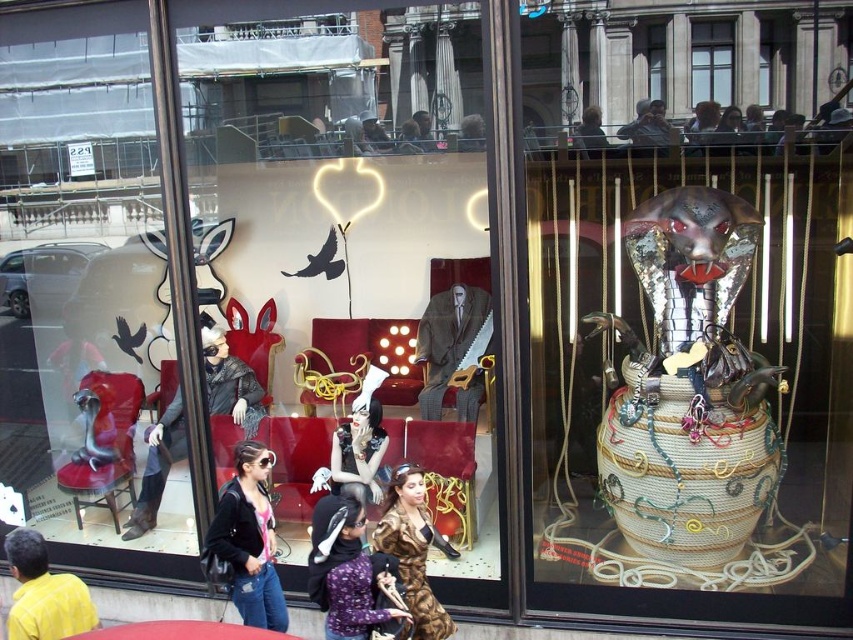
Question: Can you confirm if denim jacket at lower left is smaller than printed silk blouse at center?

Choices:
 (A) yes
 (B) no

Answer: (B)

Question: Based on their relative distances, which object is nearer to the denim jacket at lower left?

Choices:
 (A) printed silk blouse at center
 (B) clear glass window at upper center

Answer: (A)

Question: Which object is the farthest from the printed silk blouse at center?

Choices:
 (A) clear glass window at upper center
 (B) yellow shirt at lower left

Answer: (A)

Question: Can you confirm if printed silk blouse at center is bigger than leopard print dress at center?

Choices:
 (A) yes
 (B) no

Answer: (B)

Question: Which of the following is the closest to the observer?

Choices:
 (A) denim jacket at lower left
 (B) clear glass window at upper center
 (C) printed silk blouse at center
 (D) leopard print dress at center

Answer: (C)

Question: Can you confirm if denim jacket at lower left is wider than yellow shirt at lower left?

Choices:
 (A) yes
 (B) no

Answer: (B)